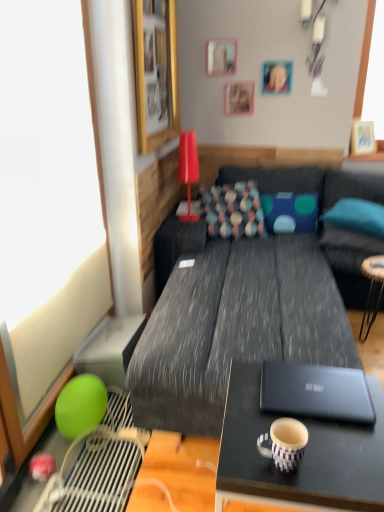
Identify the location of free space to the left of black matte laptop at center. 247,410.